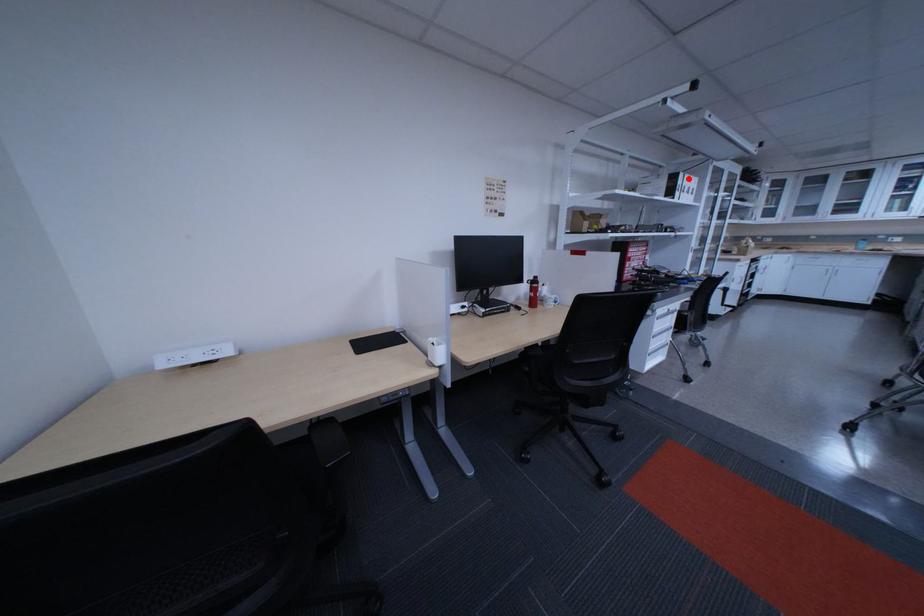
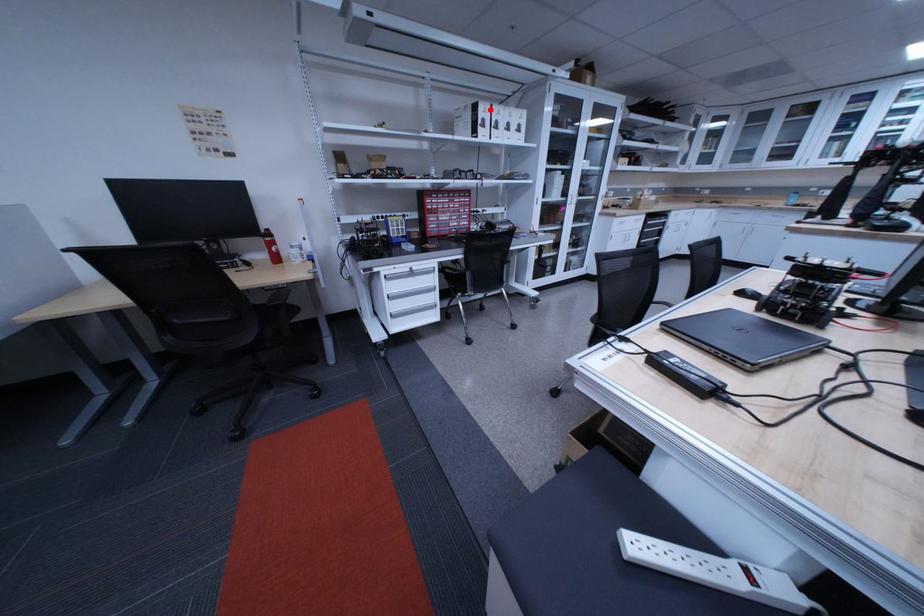
I am providing you with two images of the same scene from different viewpoints. A red point is marked on the first image and another point is marked on the second image. Is the red point in image1 aligned with the point shown in image2?

Yes